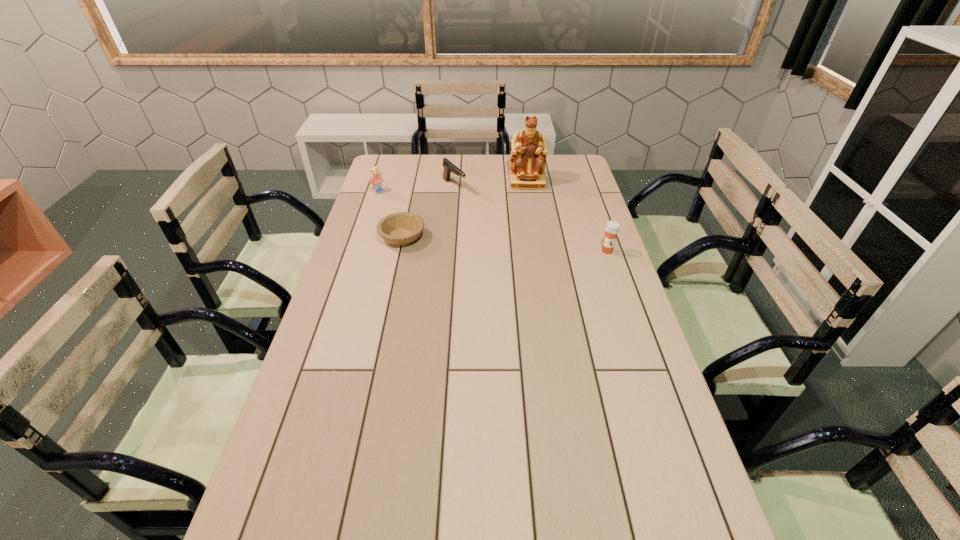
At what (x,y) coordinates should I click in order to perform the action: click on vacant region located 0.180m at the muzzle of the third object from right to left. Please return your answer as a coordinate pair (x, y). This screenshot has width=960, height=540. Looking at the image, I should click on [485, 215].

Identify the location of blank area located at the muzzle of the third object from right to left. Image resolution: width=960 pixels, height=540 pixels. (502, 231).

Identify the location of vacant area situated on the front-facing side of the Lego. The image size is (960, 540). (393, 199).

You are a GUI agent. You are given a task and a screenshot of the screen. Output one action in this format:
    pyautogui.click(x=<x>, y=<y>)
    Task: Click on the vacant space positioned on the front-facing side of the Lego
    The height and width of the screenshot is (540, 960).
    Given the screenshot: What is the action you would take?
    coord(446,225)

At what (x,y) coordinates should I click in order to perform the action: click on blank space located 0.310m on the front-facing side of the Lego. Please return your answer as a coordinate pair (x, y). Looking at the image, I should click on (439, 221).

I want to click on vacant space situated on the front-facing side of the fourth object from left to right, so click(x=529, y=219).

Where is `vacant position located on the front-facing side of the fourth object from left to right`? This screenshot has height=540, width=960. vacant position located on the front-facing side of the fourth object from left to right is located at coordinates (528, 207).

You are a GUI agent. You are given a task and a screenshot of the screen. Output one action in this format:
    pyautogui.click(x=<x>, y=<y>)
    Task: Click on the vacant space located on the front-facing side of the fourth object from left to right
    The width and height of the screenshot is (960, 540).
    Given the screenshot: What is the action you would take?
    pyautogui.click(x=529, y=219)

This screenshot has height=540, width=960. I want to click on pistol that is at the far edge, so click(449, 167).

The image size is (960, 540). In order to click on figurine present at the far edge in this screenshot , I will do `click(529, 147)`.